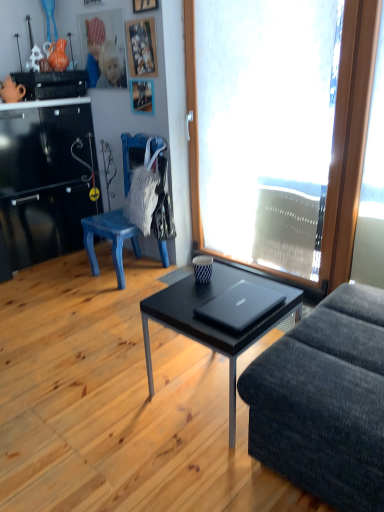
Find the location of a particular element. free point below black matte laptop at center (from a real-world perspective) is located at coordinates (242, 307).